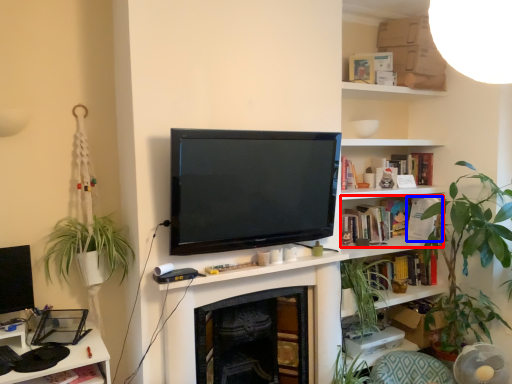
Question: Which point is further to the camera, book (highlighted by a red box) or book (highlighted by a blue box)?

Choices:
 (A) book
 (B) book

Answer: (B)